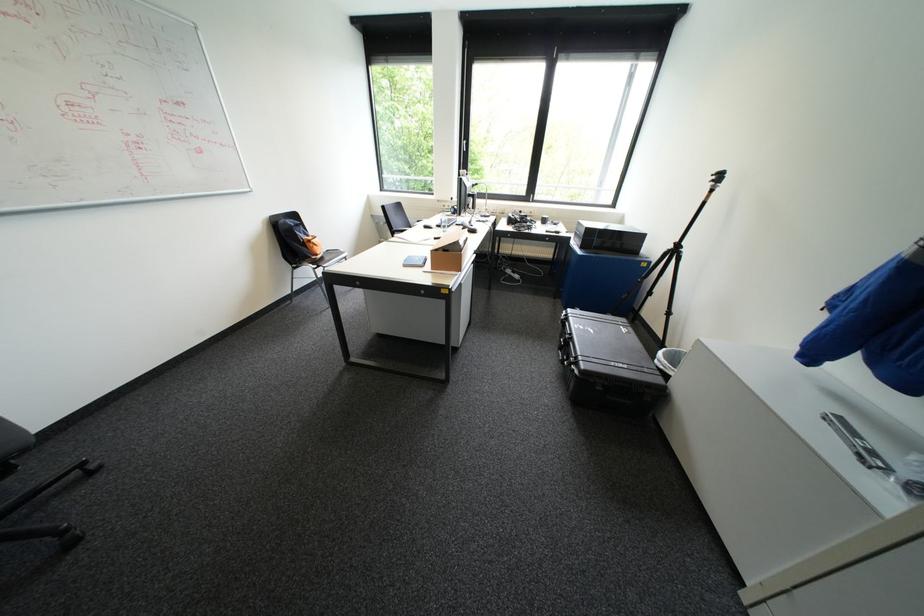
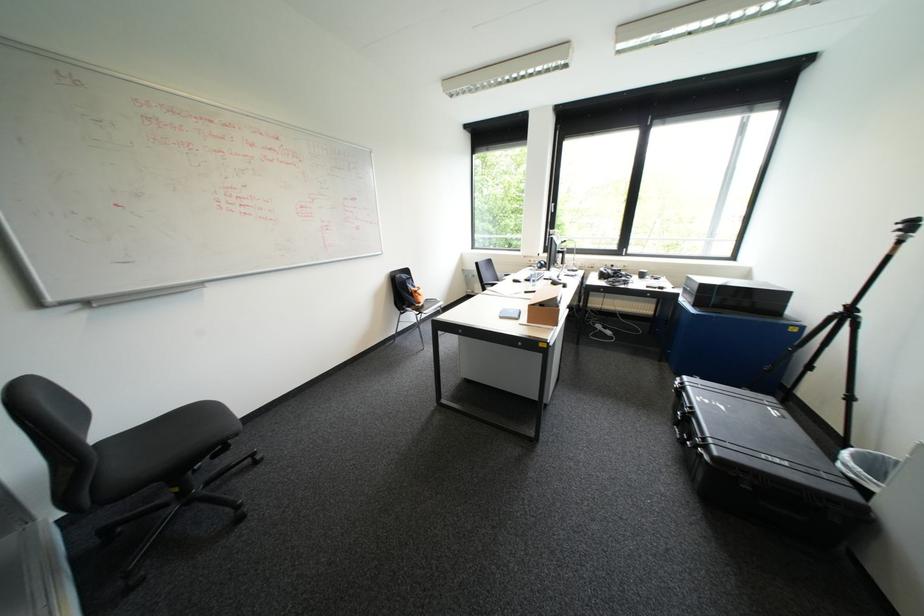
In the second image, find the point that corresponds to point 310,237 in the first image.

(419, 288)